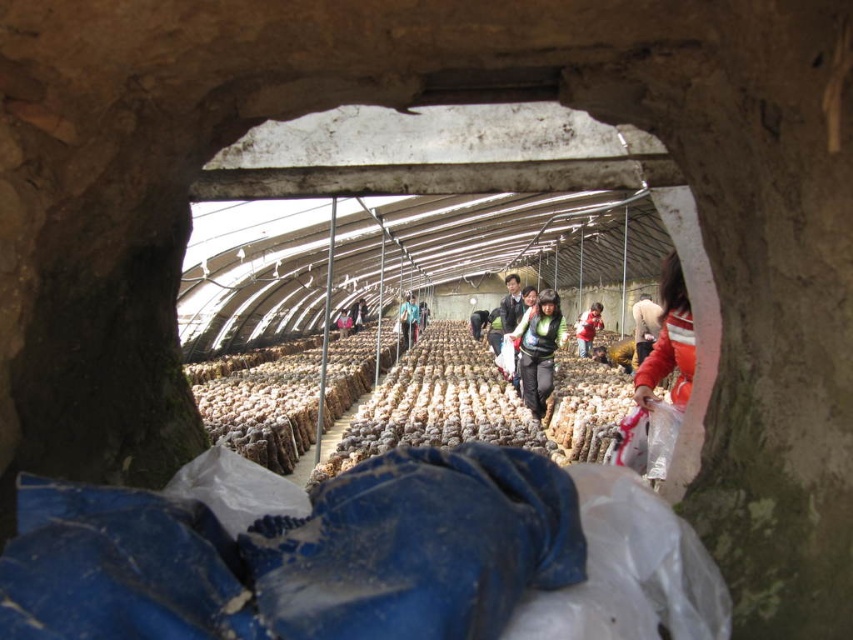
Can you confirm if red fabric jacket at center is positioned to the left of dark blue jeans at center?

Incorrect, red fabric jacket at center is not on the left side of dark blue jeans at center.

Does point (581, 316) lie behind point (357, 312)?

No, it is in front of (357, 312).

Does point (577, 339) lie in front of point (363, 304)?

Yes, point (577, 339) is closer to viewer.

Find the location of a particular element. The image size is (853, 640). red fabric jacket at center is located at coordinates (587, 328).

Who is higher up, orange fabric bag at right or dark blue fabric at center?

Positioned higher is dark blue fabric at center.

Is orange fabric bag at right wider than dark blue fabric at center?

Incorrect, orange fabric bag at right's width does not surpass dark blue fabric at center's.

The width and height of the screenshot is (853, 640). What do you see at coordinates (666, 371) in the screenshot? I see `orange fabric bag at right` at bounding box center [666, 371].

Identify the location of orange fabric bag at right. (666, 371).

Between dark green fabric at center and blue fabric bag at center, which one is positioned higher?

blue fabric bag at center is higher up.

Does dark green fabric at center have a lesser height compared to blue fabric bag at center?

Yes.

At what (x,y) coordinates should I click in order to perform the action: click on dark green fabric at center. Please return your answer as a coordinate pair (x, y). Looking at the image, I should click on (538, 349).